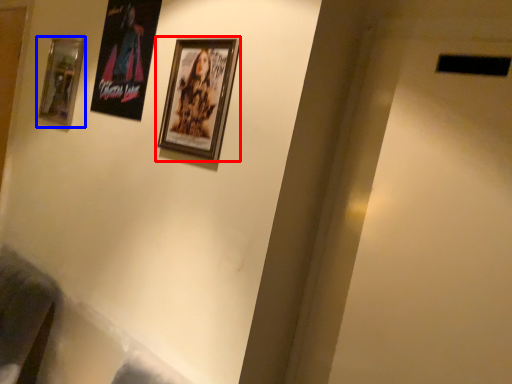
Question: Which object is closer to the camera taking this photo, picture frame (highlighted by a red box) or picture frame (highlighted by a blue box)?

Choices:
 (A) picture frame
 (B) picture frame

Answer: (A)